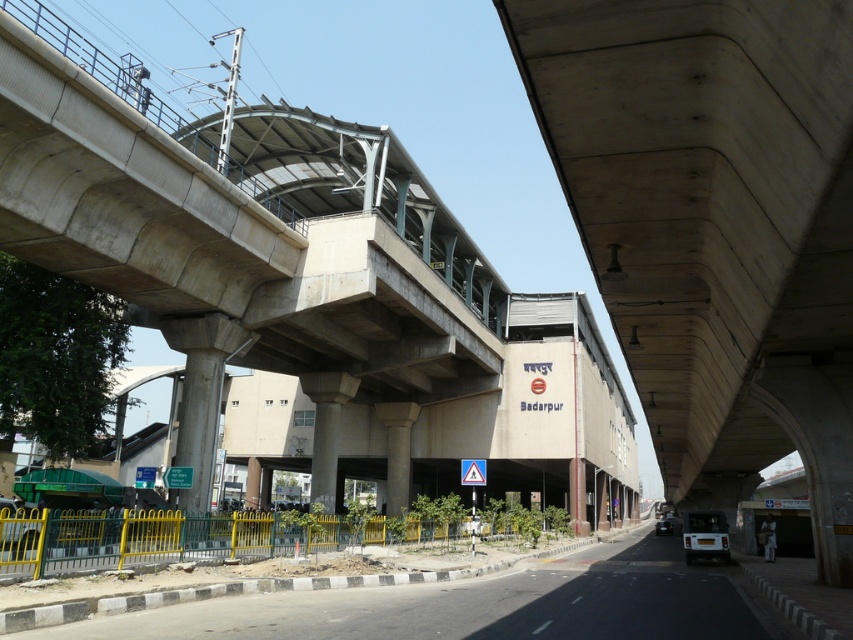
You are a construction inspector evaluating the metro station under construction. You need to compare the size of the concrete bridge at center and the white concrete pillar at center. Which one is larger?

The concrete bridge at center is bigger than the white concrete pillar at center according to the description.

You are a construction worker standing at the yellow railing near the road. You need to move to the white concrete pillar at center and the concrete column at center. According to the scene, which object is located to the left when approaching from your position?

The white concrete pillar at center is to the left of the concrete column at center, so when approaching from your position at the yellow railing, the white concrete pillar at center would be on the left side.

You are a construction worker standing at the yellow metal fence at lower left. You need to reach the top of the concrete bridge at center to inspect its structure. Given that the fence is 2 meters tall, can you estimate if the bridge requires a ladder taller than 3 meters?

The concrete bridge at center is taller than the yellow metal fence at lower left, which is 2 meters tall. Since the bridge is taller than the fence, a ladder taller than 3 meters would likely be needed to reach its top.